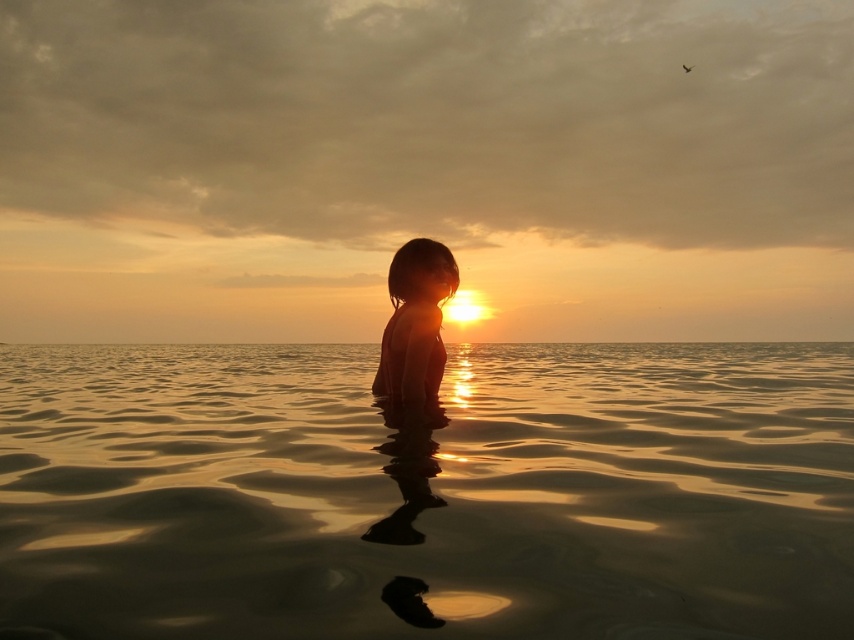
You are a photographer aiming to capture the reflection of the silhouette skin at center in the golden water at center. Given that the reflection requires the subject to be within 30 meters of the water surface, will you be able to achieve this?

The silhouette skin at center is 38.95 meters from the golden water at center, which exceeds the 30 meters requirement. Therefore, the reflection might not be visible or clear enough for the photograph.